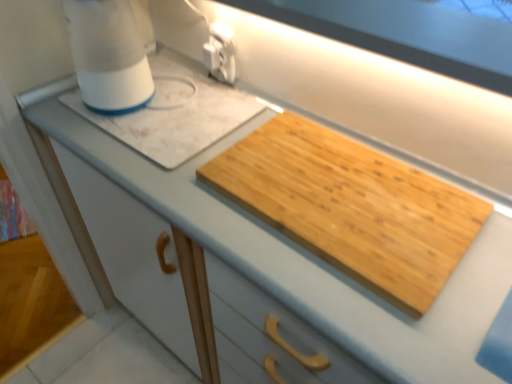
Question: Does white plastic electric outlet at upper center have a lesser height compared to white plastic blender at upper left?

Choices:
 (A) yes
 (B) no

Answer: (A)

Question: From a real-world perspective, is white plastic electric outlet at upper center positioned under white plastic blender at upper left based on gravity?

Choices:
 (A) yes
 (B) no

Answer: (A)

Question: Is white plastic electric outlet at upper center with white plastic blender at upper left?

Choices:
 (A) no
 (B) yes

Answer: (A)

Question: Does white plastic electric outlet at upper center have a greater width compared to white plastic blender at upper left?

Choices:
 (A) no
 (B) yes

Answer: (A)

Question: Is white plastic electric outlet at upper center positioned with its back to white plastic blender at upper left?

Choices:
 (A) no
 (B) yes

Answer: (A)

Question: From the image's perspective, would you say white plastic electric outlet at upper center is positioned over white plastic blender at upper left?

Choices:
 (A) yes
 (B) no

Answer: (B)

Question: Are natural wood cutting board at center and white plastic electric outlet at upper center far apart?

Choices:
 (A) yes
 (B) no

Answer: (B)

Question: Does natural wood cutting board at center have a lesser width compared to white plastic electric outlet at upper center?

Choices:
 (A) yes
 (B) no

Answer: (B)

Question: Is natural wood cutting board at center positioned behind white plastic electric outlet at upper center?

Choices:
 (A) no
 (B) yes

Answer: (A)

Question: Is natural wood cutting board at center not inside white plastic electric outlet at upper center?

Choices:
 (A) yes
 (B) no

Answer: (A)

Question: Is natural wood cutting board at center directly adjacent to white plastic electric outlet at upper center?

Choices:
 (A) yes
 (B) no

Answer: (B)

Question: Does natural wood cutting board at center appear on the left side of white plastic electric outlet at upper center?

Choices:
 (A) yes
 (B) no

Answer: (B)

Question: Does natural wood cutting board at center contain white plastic blender at upper left?

Choices:
 (A) no
 (B) yes

Answer: (A)